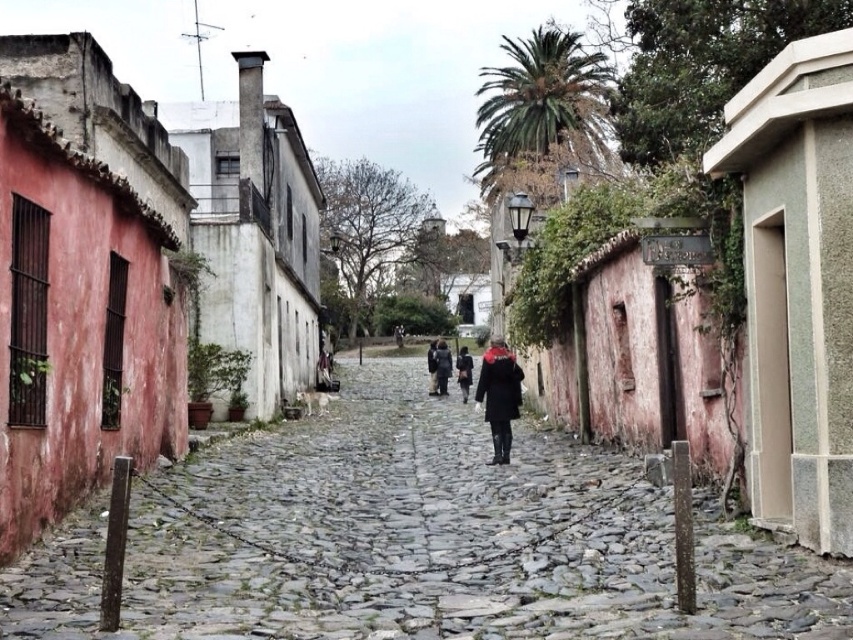
Between cobblestone street at center and dark red wool coat at center, which one is positioned higher?

Positioned higher is dark red wool coat at center.

Does cobblestone street at center have a greater height compared to dark red wool coat at center?

In fact, cobblestone street at center may be shorter than dark red wool coat at center.

Find the location of a particular element. cobblestone street at center is located at coordinates (415, 540).

Which of these two, dark red wool coat at center or dark gray coat at center, stands taller?

Standing taller between the two is dark red wool coat at center.

Which is behind, point (488, 417) or point (442, 340)?

The point (442, 340) is more distant.

The width and height of the screenshot is (853, 640). Identify the location of dark red wool coat at center. (498, 396).

Who is positioned more to the left, dark red wool coat at center or dark gray fabric coat at center?

dark gray fabric coat at center

Between point (498, 408) and point (467, 365), which one is positioned behind?

Point (467, 365)

What are the coordinates of `dark red wool coat at center` in the screenshot? It's located at (498, 396).